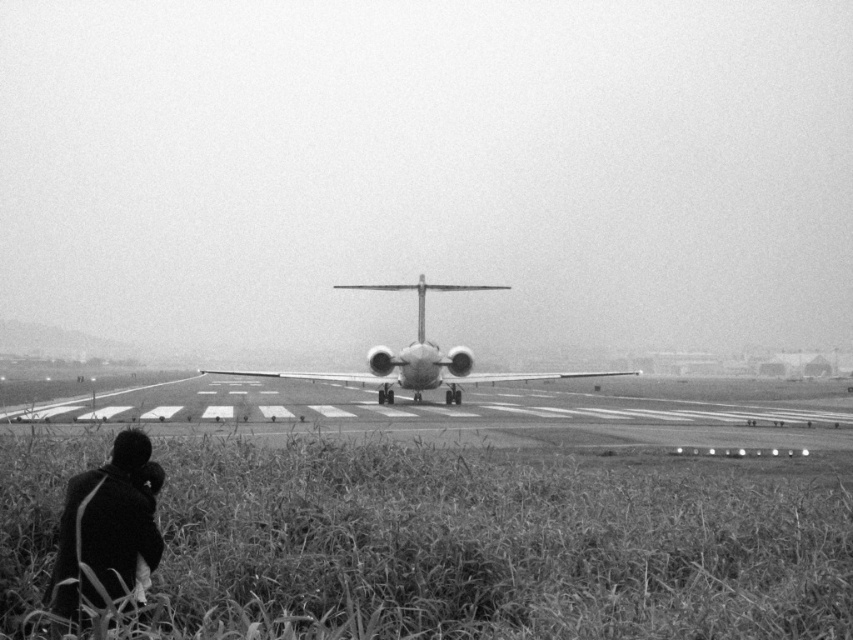
Who is more forward, (79, 531) or (465, 369)?

Point (79, 531)

Describe the element at coordinates (107, 525) in the screenshot. The height and width of the screenshot is (640, 853). I see `dark fabric coat at lower left` at that location.

The width and height of the screenshot is (853, 640). I want to click on dark fabric coat at lower left, so click(x=107, y=525).

The width and height of the screenshot is (853, 640). I want to click on dark fabric coat at lower left, so click(107, 525).